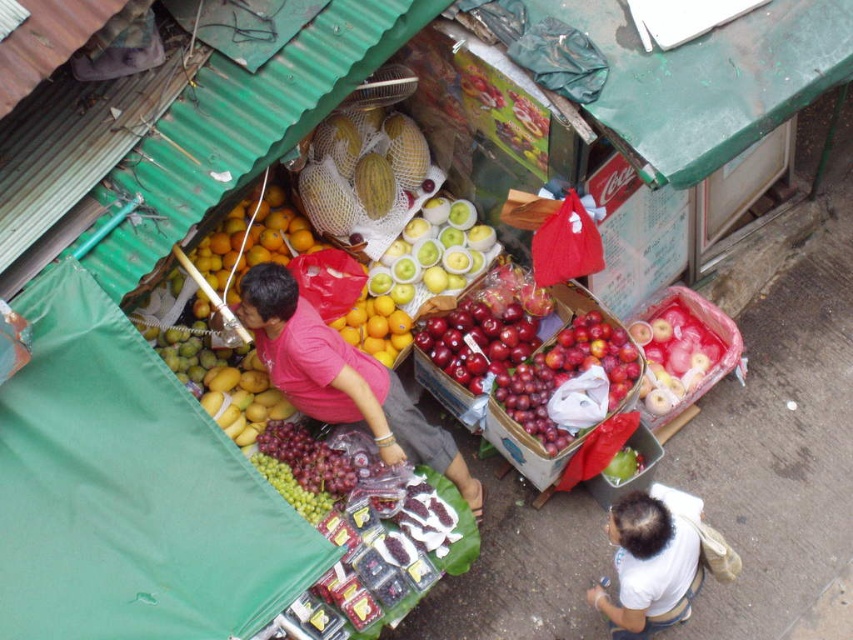
You are a customer at the market and want to buy apples. You see the pink fabric shirt at center and the red glossy apples at center. Which object is wider?

The pink fabric shirt at center is wider than the red glossy apples at center.